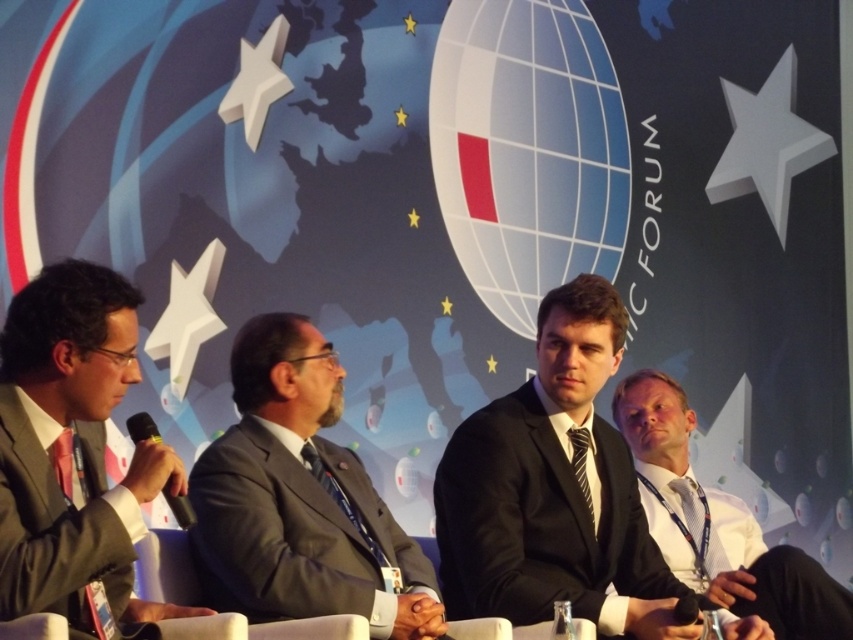
From the picture: You are a photographer at the event and want to take a photo of the matte gray suit at left and the white shirt at right. Which one should you focus on first to ensure both are in sharp focus?

The matte gray suit at left is closer to the viewer than the white shirt at right. To ensure both are in sharp focus, you should focus on the matte gray suit at left first, as it is closer, and the depth of field will extend to the white shirt at right.

You are a photographer at the event and want to capture a closeup shot of the gray suit at center. Based on the coordinates provided, where should you aim your camera?

The gray suit at center is located at coordinates point (299, 499), so aim your camera there.

You are a photographer at the event and need to capture a photo of both the gray suit at center and the white shirt at right. Based on their positions, which one should you focus on first to ensure both are in frame?

The gray suit at center is positioned on the left side of white shirt at right, so you should focus on the gray suit at center first to ensure both are in frame.